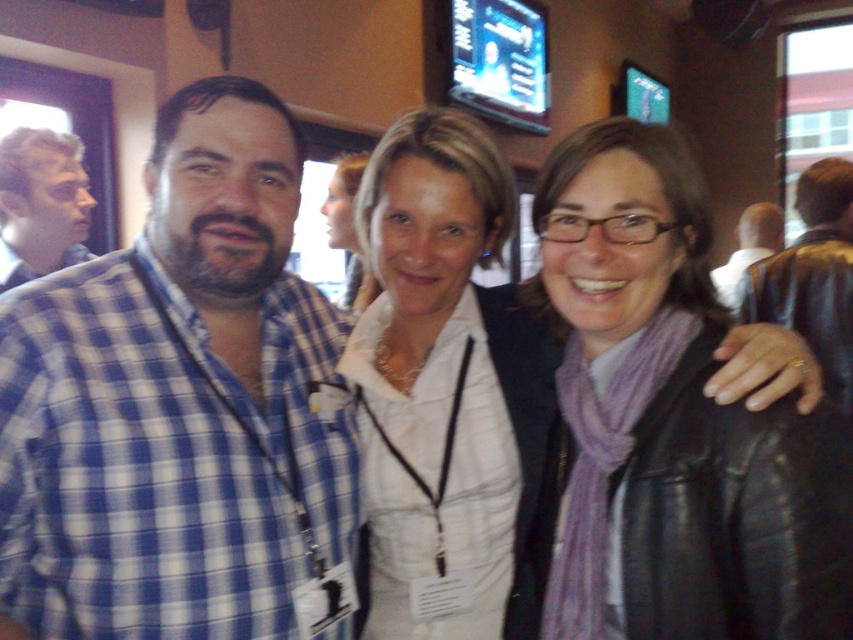
Is point (775, 268) positioned in front of point (47, 257)?

No, it is not.

Is black leather jacket at right shorter than matte blue shirt at upper left?

In fact, black leather jacket at right may be taller than matte blue shirt at upper left.

Is point (839, 193) farther from viewer compared to point (16, 182)?

Yes, point (839, 193) is behind point (16, 182).

I want to click on black leather jacket at right, so click(x=811, y=276).

Does white matte shirt at center appear under light brown leather jacket at right?

Indeed, white matte shirt at center is positioned under light brown leather jacket at right.

Is white matte shirt at center shorter than light brown leather jacket at right?

No.

Where is `white matte shirt at center`? This screenshot has width=853, height=640. white matte shirt at center is located at coordinates (442, 380).

Is purple scarf at center thinner than matte white shirt at center?

No.

Which is above, purple scarf at center or matte white shirt at center?

matte white shirt at center

The height and width of the screenshot is (640, 853). I want to click on purple scarf at center, so click(x=666, y=426).

Where is `purple scarf at center`? purple scarf at center is located at coordinates (666, 426).